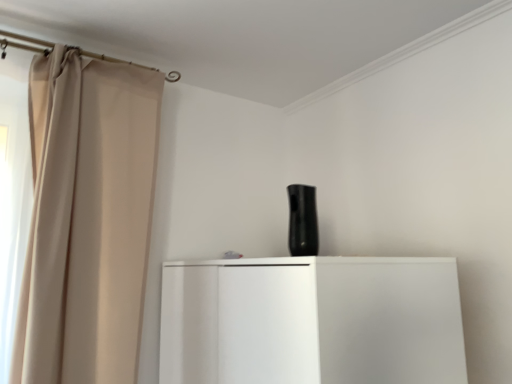
Question: Does point (50, 364) appear closer or farther from the camera than point (309, 221)?

Choices:
 (A) closer
 (B) farther

Answer: (B)

Question: Is beige fabric curtain at left bigger or smaller than black matte speaker at center?

Choices:
 (A) small
 (B) big

Answer: (B)

Question: In the image, is beige fabric curtain at left positioned in front of or behind black matte speaker at center?

Choices:
 (A) behind
 (B) front

Answer: (B)

Question: Looking at their shapes, would you say black matte speaker at center is wider or thinner than beige fabric curtain at left?

Choices:
 (A) thin
 (B) wide

Answer: (A)

Question: Would you say black matte speaker at center is to the left or to the right of beige fabric curtain at left in the picture?

Choices:
 (A) right
 (B) left

Answer: (A)

Question: From a real-world perspective, is black matte speaker at center above or below beige fabric curtain at left?

Choices:
 (A) above
 (B) below

Answer: (B)

Question: Do you think black matte speaker at center is within beige fabric curtain at left, or outside of it?

Choices:
 (A) inside
 (B) outside

Answer: (B)